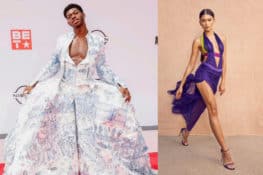
This screenshot has height=175, width=263. What are the coordinates of `red carpet` in the screenshot? It's located at point(154,166).